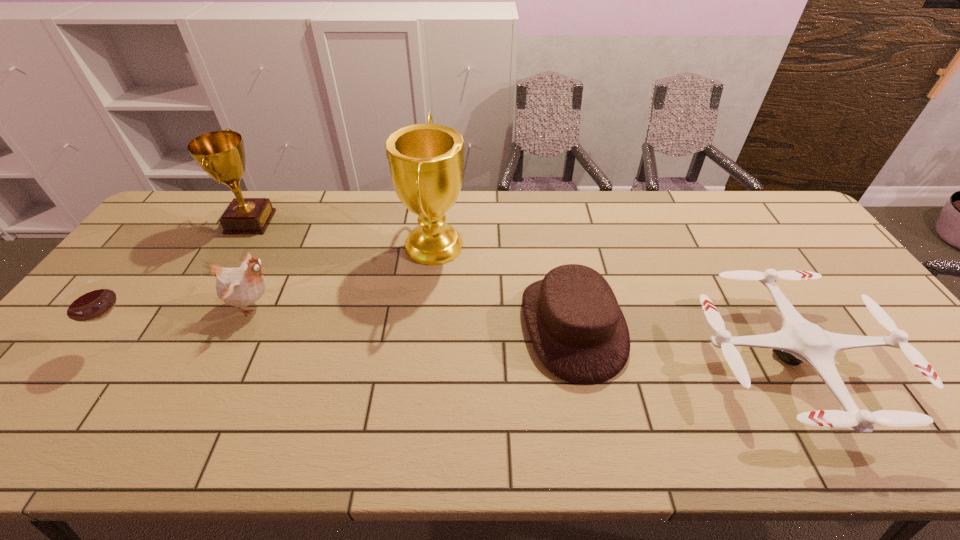
Where is `free region at the far edge of the desktop`? The height and width of the screenshot is (540, 960). free region at the far edge of the desktop is located at coordinates (721, 218).

Where is `vacant position at the near edge of the desktop`? The width and height of the screenshot is (960, 540). vacant position at the near edge of the desktop is located at coordinates (673, 428).

Locate an element on the screen. The width and height of the screenshot is (960, 540). vacant space at the right edge is located at coordinates (806, 237).

In the image, there is a desktop. At what (x,y) coordinates should I click in order to perform the action: click on vacant space at the near left corner. Please return your answer as a coordinate pair (x, y). Image resolution: width=960 pixels, height=540 pixels. Looking at the image, I should click on (45, 447).

Find the location of `free space at the far right corner`. free space at the far right corner is located at coordinates (x=778, y=218).

At what (x,y) coordinates should I click in order to perform the action: click on vacant space in between the bird and the wineglass. Please return your answer as a coordinate pair (x, y). Looking at the image, I should click on (189, 323).

Where is `empty location between the fifth object from left to right and the right award`? empty location between the fifth object from left to right and the right award is located at coordinates (503, 285).

The height and width of the screenshot is (540, 960). I want to click on free area in between the right award and the wineglass, so click(279, 292).

At what (x,y) coordinates should I click in order to perform the action: click on free space between the taller award and the wineglass. Please return your answer as a coordinate pair (x, y). This screenshot has width=960, height=540. Looking at the image, I should click on (279, 292).

What are the coordinates of `vacant space that is in between the right award and the leftmost object` in the screenshot? It's located at (279, 292).